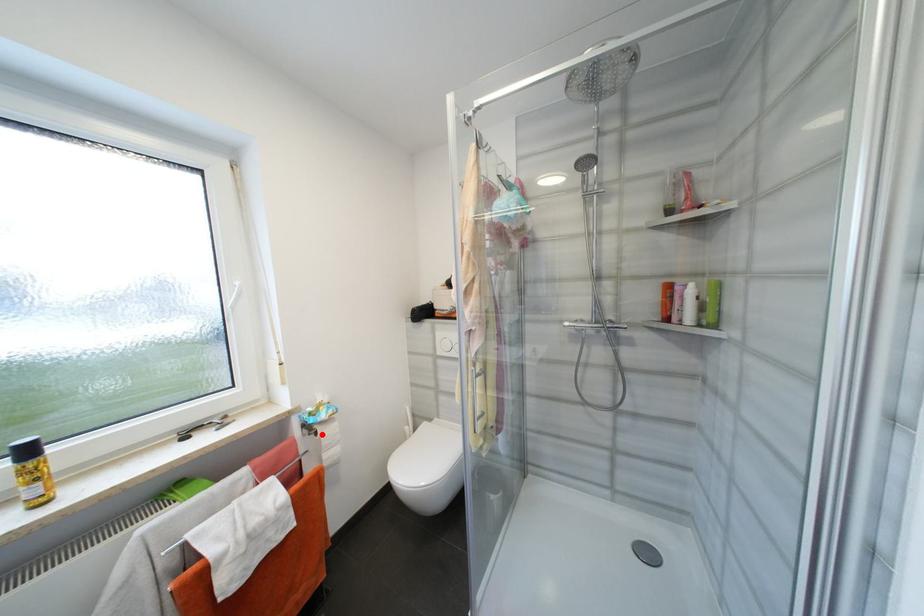
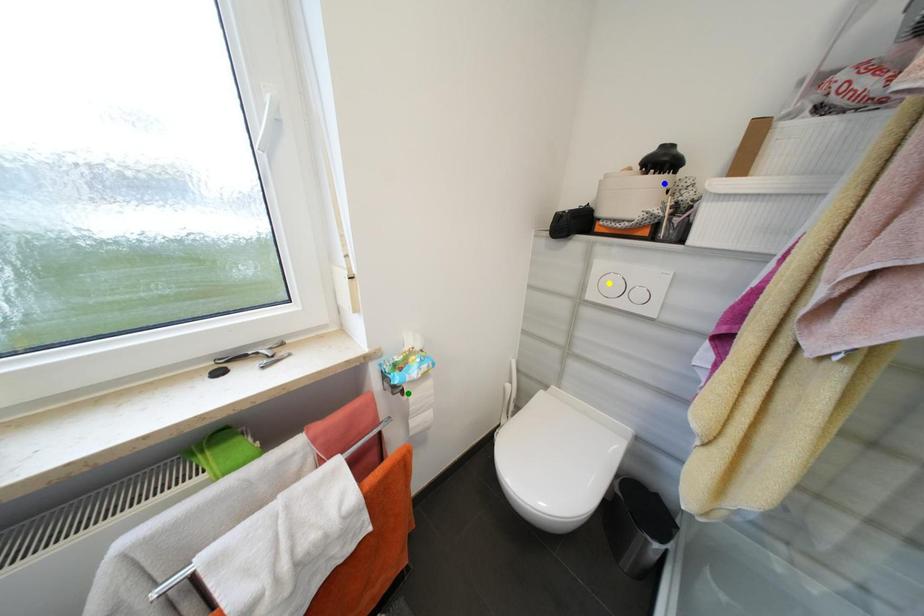
Question: I am providing you with two images of the same scene from different viewpoints. A red point is marked on the first image. You are given multiple points on the second image. Which mark in image 2 goes with the point in image 1?

Choices:
 (A) blue point
 (B) green point
 (C) yellow point

Answer: (B)